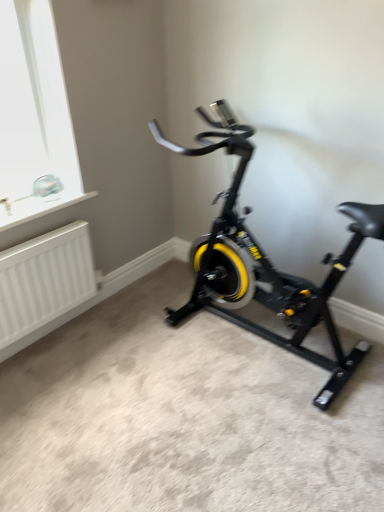
Question: Can you confirm if white matte radiator at lower left is wider than black matte stationary bicycle at center?

Choices:
 (A) no
 (B) yes

Answer: (A)

Question: Are white matte radiator at lower left and black matte stationary bicycle at center far apart?

Choices:
 (A) yes
 (B) no

Answer: (B)

Question: From the image's perspective, is white matte radiator at lower left on top of black matte stationary bicycle at center?

Choices:
 (A) no
 (B) yes

Answer: (A)

Question: Does white matte radiator at lower left have a greater height compared to black matte stationary bicycle at center?

Choices:
 (A) no
 (B) yes

Answer: (A)

Question: From a real-world perspective, is white matte radiator at lower left positioned over black matte stationary bicycle at center based on gravity?

Choices:
 (A) yes
 (B) no

Answer: (B)

Question: Does white matte radiator at lower left turn towards black matte stationary bicycle at center?

Choices:
 (A) yes
 (B) no

Answer: (A)

Question: Could you tell me if black matte stationary bicycle at center is turned towards white matte radiator at lower left?

Choices:
 (A) no
 (B) yes

Answer: (A)

Question: Can you confirm if black matte stationary bicycle at center is shorter than white matte radiator at lower left?

Choices:
 (A) no
 (B) yes

Answer: (A)

Question: Is white matte radiator at lower left a part of black matte stationary bicycle at center?

Choices:
 (A) no
 (B) yes

Answer: (A)

Question: Is the surface of black matte stationary bicycle at center in direct contact with white matte radiator at lower left?

Choices:
 (A) yes
 (B) no

Answer: (B)

Question: From the image's perspective, would you say black matte stationary bicycle at center is shown under white matte radiator at lower left?

Choices:
 (A) no
 (B) yes

Answer: (A)

Question: Would you say black matte stationary bicycle at center is a long distance from white matte radiator at lower left?

Choices:
 (A) yes
 (B) no

Answer: (B)

Question: Considering the positions of white matte radiator at lower left and black matte stationary bicycle at center in the image, is white matte radiator at lower left wider or thinner than black matte stationary bicycle at center?

Choices:
 (A) wide
 (B) thin

Answer: (B)